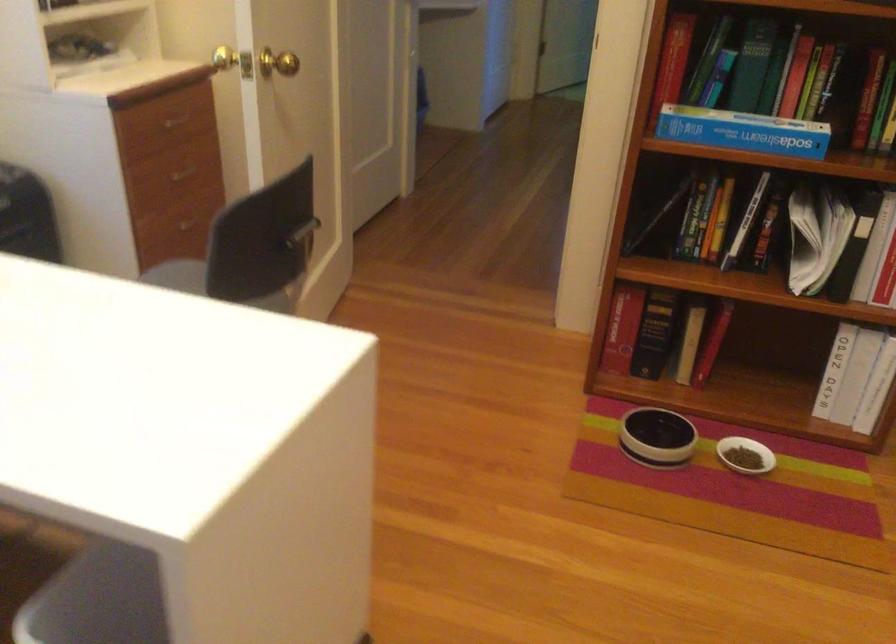
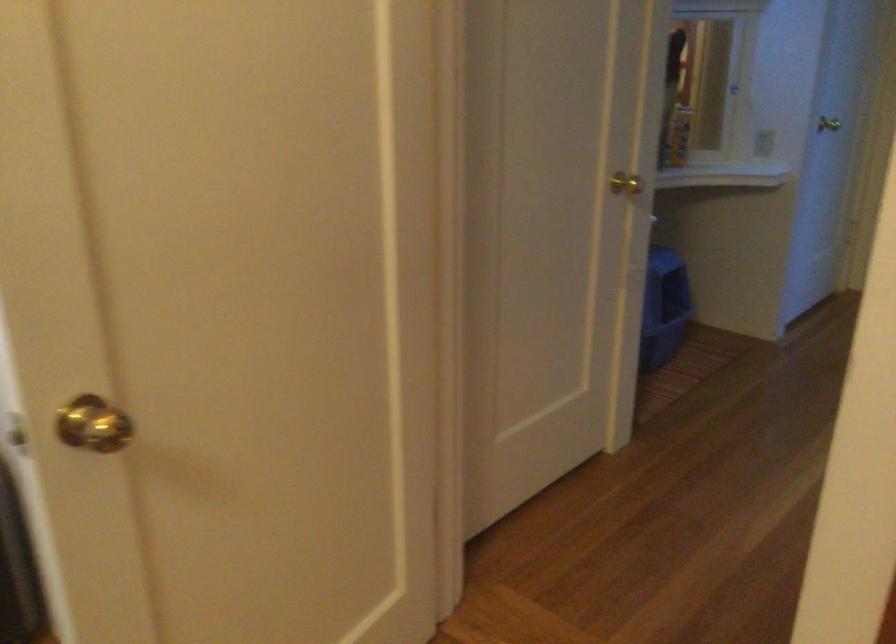
Question: I am providing you with two images of the same scene from different viewpoints. After the viewpoint changes to image2, which objects are now occluded?

Choices:
 (A) brass doorknob
 (B) blue litter box
 (C) drawer knob
 (D) journal on shelf

Answer: (C)